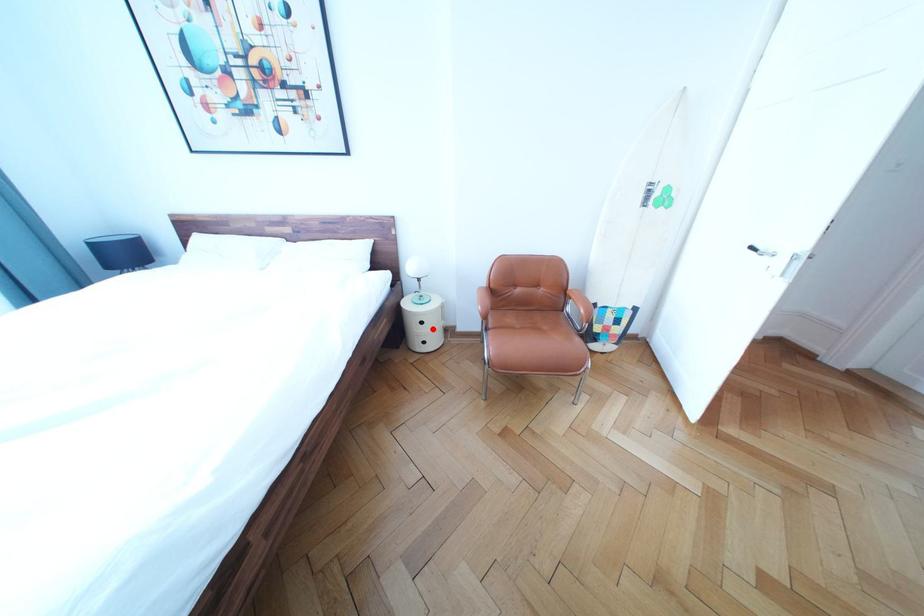
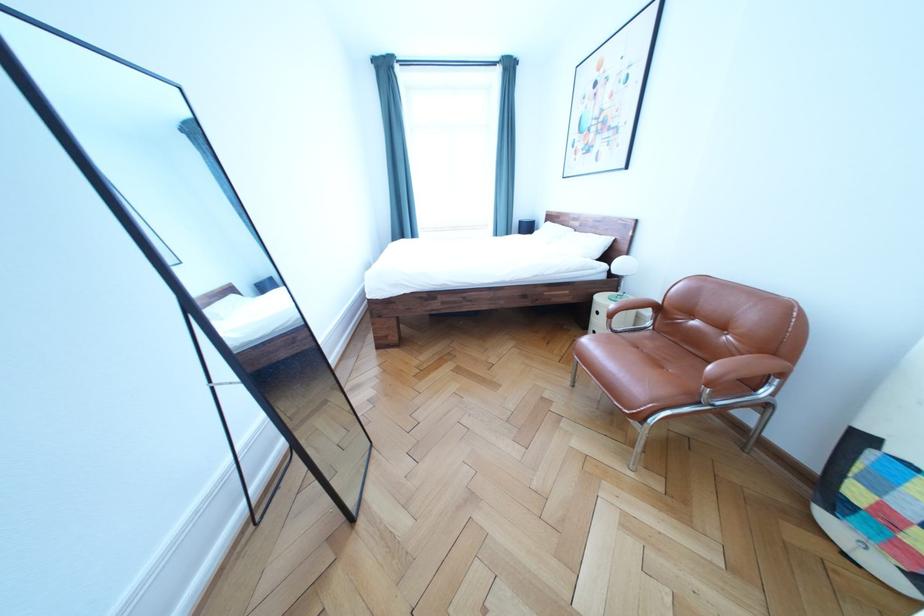
Find the pixel in the second image that matches the highlighted location in the first image.

(609, 318)